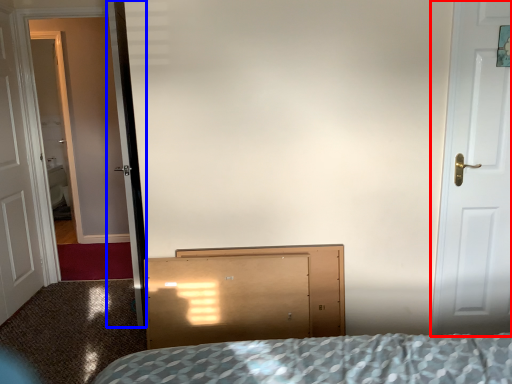
Question: Among these objects, which one is nearest to the camera, door (highlighted by a red box) or screen door (highlighted by a blue box)?

Choices:
 (A) door
 (B) screen door

Answer: (A)